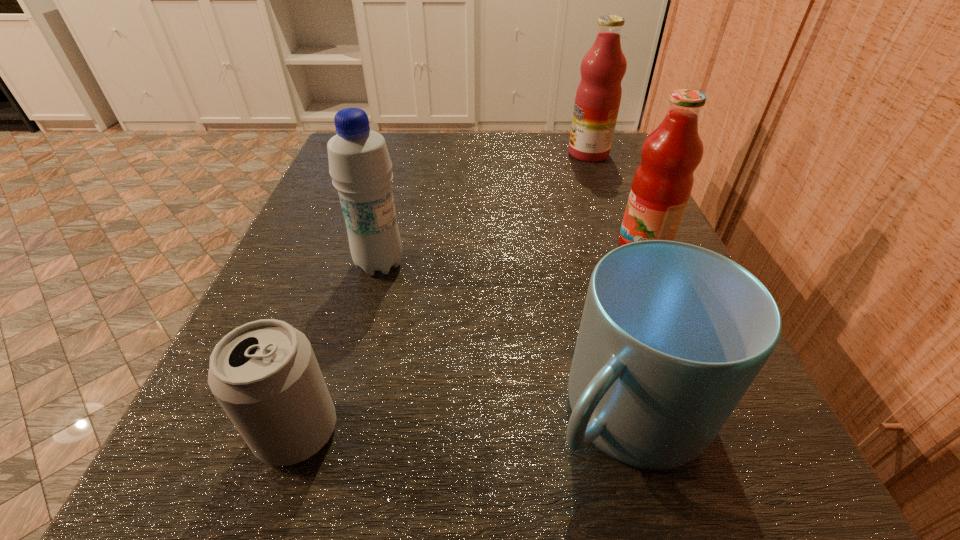
Where is `vacant space located on the front label of the nearer fruit juice`? The height and width of the screenshot is (540, 960). vacant space located on the front label of the nearer fruit juice is located at coordinates (516, 246).

This screenshot has height=540, width=960. Find the location of `free space located on the back of the water bottle`. free space located on the back of the water bottle is located at coordinates (400, 182).

Locate an element on the screen. vacant space located on the left of the mug is located at coordinates (424, 412).

This screenshot has height=540, width=960. In order to click on vacant space situated 0.300m on the back of the can in this screenshot , I will do tap(362, 234).

Where is `object that is at the far edge`? The width and height of the screenshot is (960, 540). object that is at the far edge is located at coordinates (598, 96).

Find the location of a particular element. This screenshot has height=540, width=960. mug at the near edge is located at coordinates (672, 335).

Locate an element on the screen. This screenshot has width=960, height=540. can present at the near edge is located at coordinates pos(264,374).

In order to click on water bottle that is at the left edge in this screenshot , I will do `click(360, 166)`.

The height and width of the screenshot is (540, 960). What are the coordinates of `can situated at the left edge` in the screenshot? It's located at (264, 374).

You are a GUI agent. You are given a task and a screenshot of the screen. Output one action in this format:
    pyautogui.click(x=<x>, y=<y>)
    Task: Click on the mug present at the right edge
    This screenshot has width=960, height=540.
    Given the screenshot: What is the action you would take?
    pyautogui.click(x=672, y=335)